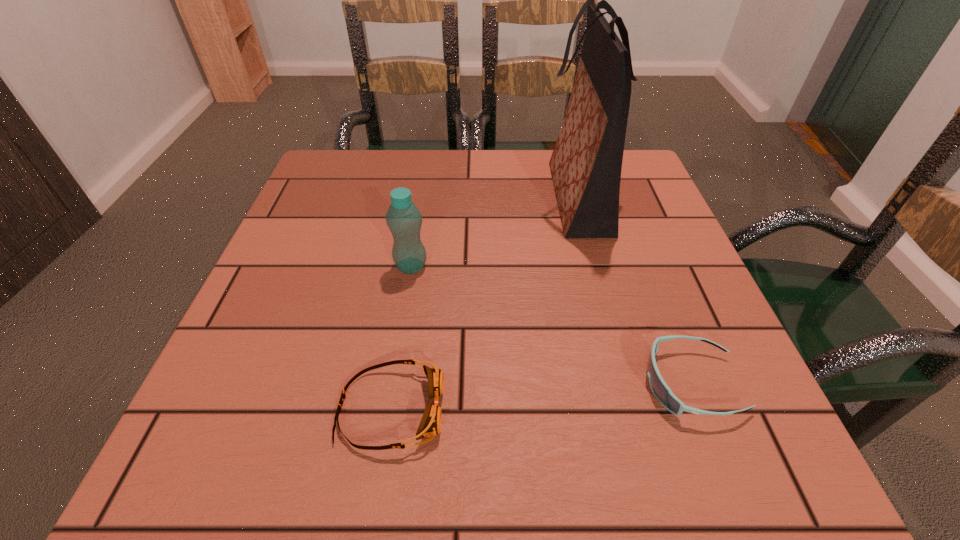
This screenshot has width=960, height=540. In order to click on the farthest object in this screenshot , I will do pyautogui.click(x=586, y=163).

Where is `the tallest object`? The image size is (960, 540). the tallest object is located at coordinates (586, 163).

Locate an element on the screen. the second farthest object is located at coordinates (403, 218).

Identify the location of the third shortest object. (403, 218).

This screenshot has width=960, height=540. I want to click on the right goggles, so click(660, 389).

Where is `the left goggles`? Image resolution: width=960 pixels, height=540 pixels. the left goggles is located at coordinates (430, 425).

Find the location of `free space located 0.270m on the front-facing side of the farthest object`. free space located 0.270m on the front-facing side of the farthest object is located at coordinates (424, 198).

Find the location of a particular element. The width and height of the screenshot is (960, 540). free space located on the front-facing side of the farthest object is located at coordinates (468, 198).

Find the location of a particular element. vacant space located on the front-facing side of the farthest object is located at coordinates (463, 198).

Locate an element on the screen. The width and height of the screenshot is (960, 540). free space located 0.320m at the front cap of the third shortest object is located at coordinates (594, 266).